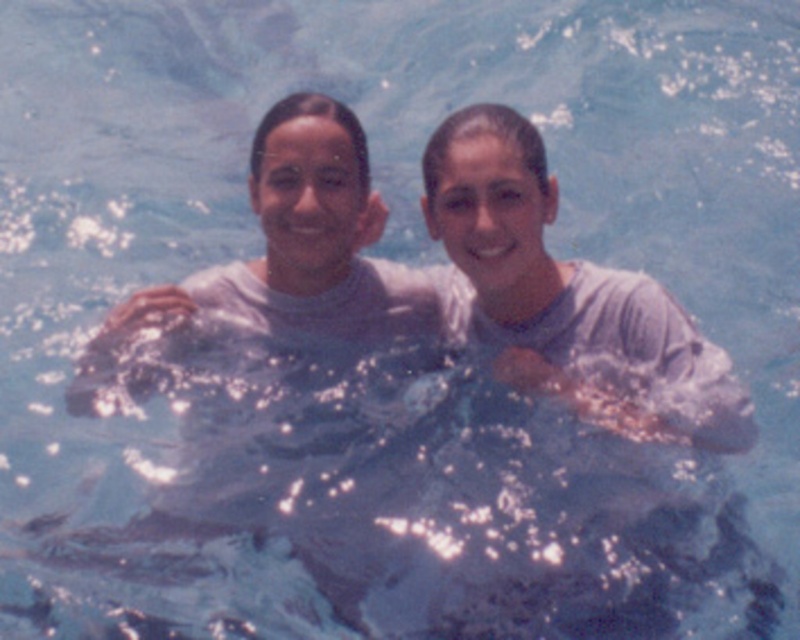
Is point (193, 308) positioned behind point (505, 225)?

Yes, it is.

Who is more forward, (336, 316) or (482, 128)?

Positioned in front is point (482, 128).

Does point (264, 310) come in front of point (470, 324)?

Yes.

Find the location of a particular element. This screenshot has width=800, height=640. white matte skin at center is located at coordinates (458, 275).

Does point (538, 186) come in front of point (436, 316)?

Yes, point (538, 186) is in front of point (436, 316).

Measure the distance between point (680, 308) and camera.

Point (680, 308) and camera are 4.73 meters apart.

Is point (490, 192) positioned in front of point (168, 310)?

Yes, point (490, 192) is in front of point (168, 310).

Find the location of a particular element. The width and height of the screenshot is (800, 640). gray matte shirt at center is located at coordinates (568, 294).

Is white matte skin at center to the left of matte gray shirt at center from the viewer's perspective?

No, white matte skin at center is not to the left of matte gray shirt at center.

Can you confirm if white matte skin at center is positioned to the right of matte gray shirt at center?

Correct, you'll find white matte skin at center to the right of matte gray shirt at center.

Locate an element on the screen. white matte skin at center is located at coordinates point(458,275).

You are a GUI agent. You are given a task and a screenshot of the screen. Output one action in this format:
    pyautogui.click(x=<x>, y=<y>)
    Task: Click on the white matte skin at center
    The width and height of the screenshot is (800, 640).
    Given the screenshot: What is the action you would take?
    pyautogui.click(x=458, y=275)